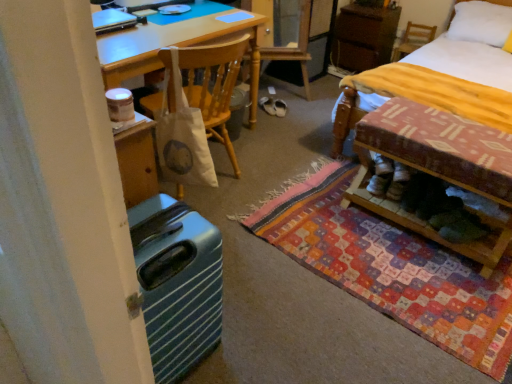
The image size is (512, 384). I want to click on free spot behind white fabric shoe at center, the 2th footwear viewed from the left, so click(292, 99).